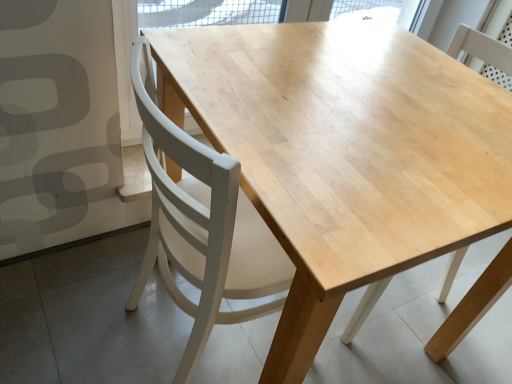
Find the location of a particular element. The width and height of the screenshot is (512, 384). white wood chair at center, arranged as the first chair when viewed from the left is located at coordinates (203, 226).

The height and width of the screenshot is (384, 512). Describe the element at coordinates (203, 226) in the screenshot. I see `white wood chair at center, positioned as the 2th chair in right-to-left order` at that location.

Locate an element on the screen. light wood chair at center, marked as the 1th chair in a right-to-left arrangement is located at coordinates (473, 305).

The height and width of the screenshot is (384, 512). Describe the element at coordinates (473, 305) in the screenshot. I see `light wood chair at center, marked as the 1th chair in a right-to-left arrangement` at that location.

Where is `white wood chair at center, positioned as the 2th chair in right-to-left order`? The width and height of the screenshot is (512, 384). white wood chair at center, positioned as the 2th chair in right-to-left order is located at coordinates (203, 226).

Considering the positions of objects light wood chair at center, marked as the 1th chair in a right-to-left arrangement, and white wood chair at center, arranged as the first chair when viewed from the left, in the image provided, who is more to the left, light wood chair at center, marked as the 1th chair in a right-to-left arrangement, or white wood chair at center, arranged as the first chair when viewed from the left,?

white wood chair at center, arranged as the first chair when viewed from the left.

Which object is closer to the camera, light wood chair at center, which ranks as the 2th chair in left-to-right order, or white wood chair at center, arranged as the first chair when viewed from the left?

white wood chair at center, arranged as the first chair when viewed from the left, is more forward.

Is point (373, 298) less distant than point (202, 195)?

No, (373, 298) is further to viewer.

From the image's perspective, which is above, light wood chair at center, marked as the 1th chair in a right-to-left arrangement, or white wood chair at center, positioned as the 2th chair in right-to-left order?

light wood chair at center, marked as the 1th chair in a right-to-left arrangement.

From a real-world perspective, is light wood chair at center, marked as the 1th chair in a right-to-left arrangement, over white wood chair at center, positioned as the 2th chair in right-to-left order?

No, from a real-world perspective, light wood chair at center, marked as the 1th chair in a right-to-left arrangement, is not over white wood chair at center, positioned as the 2th chair in right-to-left order

Can you confirm if light wood chair at center, marked as the 1th chair in a right-to-left arrangement, is wider than white wood chair at center, positioned as the 2th chair in right-to-left order?

Incorrect, the width of light wood chair at center, marked as the 1th chair in a right-to-left arrangement, does not surpass that of white wood chair at center, positioned as the 2th chair in right-to-left order.

Considering the sizes of objects light wood chair at center, which ranks as the 2th chair in left-to-right order, and white wood chair at center, positioned as the 2th chair in right-to-left order, in the image provided, who is shorter, light wood chair at center, which ranks as the 2th chair in left-to-right order, or white wood chair at center, positioned as the 2th chair in right-to-left order,?

light wood chair at center, which ranks as the 2th chair in left-to-right order.

Considering the relative sizes of light wood chair at center, marked as the 1th chair in a right-to-left arrangement, and white wood chair at center, arranged as the first chair when viewed from the left, in the image provided, is light wood chair at center, marked as the 1th chair in a right-to-left arrangement, bigger than white wood chair at center, arranged as the first chair when viewed from the left,?

Incorrect, light wood chair at center, marked as the 1th chair in a right-to-left arrangement, is not larger than white wood chair at center, arranged as the first chair when viewed from the left.

Is light wood chair at center, marked as the 1th chair in a right-to-left arrangement, spatially inside white wood chair at center, arranged as the first chair when viewed from the left, or outside of it?

The correct answer is: outside.

Is light wood chair at center, which ranks as the 2th chair in left-to-right order, touching white wood chair at center, arranged as the first chair when viewed from the left?

No, light wood chair at center, which ranks as the 2th chair in left-to-right order, is not next to white wood chair at center, arranged as the first chair when viewed from the left.

Is light wood chair at center, marked as the 1th chair in a right-to-left arrangement, oriented away from white wood chair at center, positioned as the 2th chair in right-to-left order?

No, light wood chair at center, marked as the 1th chair in a right-to-left arrangement, is not facing away from white wood chair at center, positioned as the 2th chair in right-to-left order.

How different are the orientations of light wood chair at center, which ranks as the 2th chair in left-to-right order, and white wood chair at center, arranged as the first chair when viewed from the left, in degrees?

The angle between the facing direction of light wood chair at center, which ranks as the 2th chair in left-to-right order, and the facing direction of white wood chair at center, arranged as the first chair when viewed from the left, is 177 degrees.

Measure the distance from light wood chair at center, marked as the 1th chair in a right-to-left arrangement, to white wood chair at center, arranged as the first chair when viewed from the left.

light wood chair at center, marked as the 1th chair in a right-to-left arrangement, and white wood chair at center, arranged as the first chair when viewed from the left, are 28.98 inches apart.

This screenshot has height=384, width=512. What are the coordinates of `chair above the white wood chair at center, positioned as the 2th chair in right-to-left order (from the image's perspective)` in the screenshot? It's located at (473, 305).

Is white wood chair at center, positioned as the 2th chair in right-to-left order, to the right of light wood chair at center, which ranks as the 2th chair in left-to-right order, from the viewer's perspective?

No.

Is white wood chair at center, positioned as the 2th chair in right-to-left order, in front of light wood chair at center, marked as the 1th chair in a right-to-left arrangement?

Yes, white wood chair at center, positioned as the 2th chair in right-to-left order, is in front of light wood chair at center, marked as the 1th chair in a right-to-left arrangement.

Which is nearer, (179,202) or (442,351)?

The point (179,202) is more forward.

From the image's perspective, is white wood chair at center, arranged as the first chair when viewed from the left, located beneath light wood chair at center, marked as the 1th chair in a right-to-left arrangement?

Indeed, from the image's perspective, white wood chair at center, arranged as the first chair when viewed from the left, is shown beneath light wood chair at center, marked as the 1th chair in a right-to-left arrangement.

From a real-world perspective, between white wood chair at center, arranged as the first chair when viewed from the left, and light wood chair at center, marked as the 1th chair in a right-to-left arrangement, who is vertically higher?

white wood chair at center, arranged as the first chair when viewed from the left.

Does white wood chair at center, arranged as the first chair when viewed from the left, have a greater width compared to light wood chair at center, which ranks as the 2th chair in left-to-right order?

Yes, white wood chair at center, arranged as the first chair when viewed from the left, is wider than light wood chair at center, which ranks as the 2th chair in left-to-right order.

Between white wood chair at center, positioned as the 2th chair in right-to-left order, and light wood chair at center, which ranks as the 2th chair in left-to-right order, which one has less height?

Standing shorter between the two is light wood chair at center, which ranks as the 2th chair in left-to-right order.

Which of these two, white wood chair at center, positioned as the 2th chair in right-to-left order, or light wood chair at center, which ranks as the 2th chair in left-to-right order, is bigger?

With larger size is white wood chair at center, positioned as the 2th chair in right-to-left order.

Is white wood chair at center, arranged as the first chair when viewed from the left, inside the boundaries of light wood chair at center, which ranks as the 2th chair in left-to-right order, or outside?

The correct answer is: outside.

Looking at this image, are white wood chair at center, arranged as the first chair when viewed from the left, and light wood chair at center, marked as the 1th chair in a right-to-left arrangement, beside each other?

No, white wood chair at center, arranged as the first chair when viewed from the left, is not in contact with light wood chair at center, marked as the 1th chair in a right-to-left arrangement.

Is white wood chair at center, arranged as the first chair when viewed from the left, aimed at light wood chair at center, which ranks as the 2th chair in left-to-right order?

Yes, white wood chair at center, arranged as the first chair when viewed from the left, is turned towards light wood chair at center, which ranks as the 2th chair in left-to-right order.

The height and width of the screenshot is (384, 512). Find the location of `chair to the left of light wood chair at center, marked as the 1th chair in a right-to-left arrangement`. chair to the left of light wood chair at center, marked as the 1th chair in a right-to-left arrangement is located at coordinates (203, 226).

I want to click on chair that is under the white wood chair at center, positioned as the 2th chair in right-to-left order (from a real-world perspective), so click(473, 305).

This screenshot has height=384, width=512. In order to click on chair located on the left of light wood chair at center, which ranks as the 2th chair in left-to-right order in this screenshot , I will do [x=203, y=226].